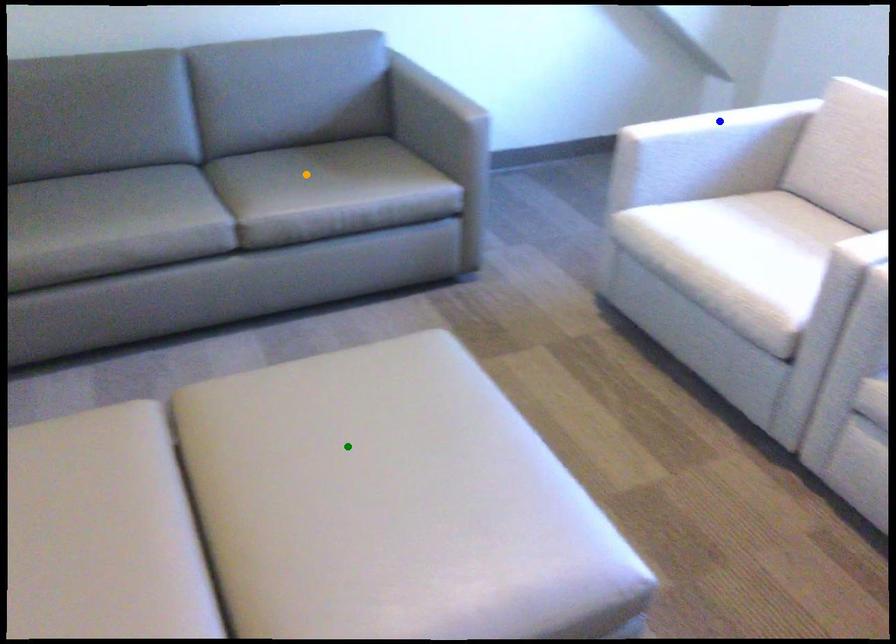
Order these from nearest to farthest:
A) green point
B) blue point
C) orange point

green point, blue point, orange point